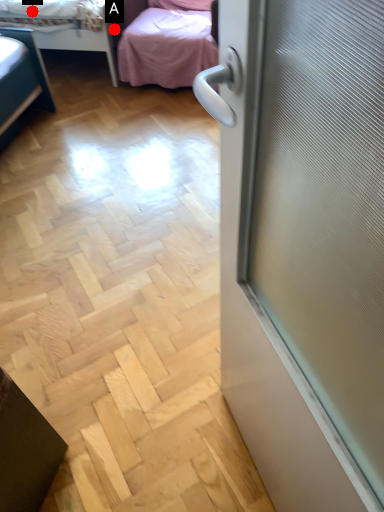
Question: Two points are circled on the image, labeled by A and B beside each circle. Which of the following is the farthest from the observer?

Choices:
 (A) A is further
 (B) B is further

Answer: (A)